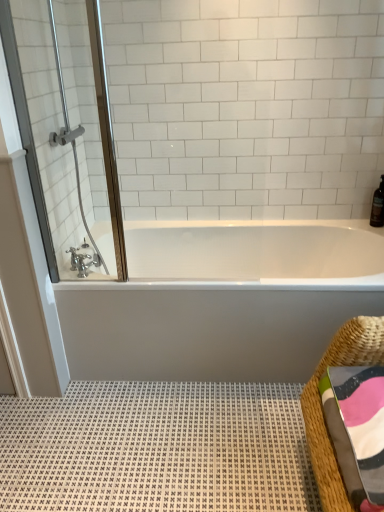
Identify the location of free space in front of brushed metal faucet at lower left. The image size is (384, 512). (82, 283).